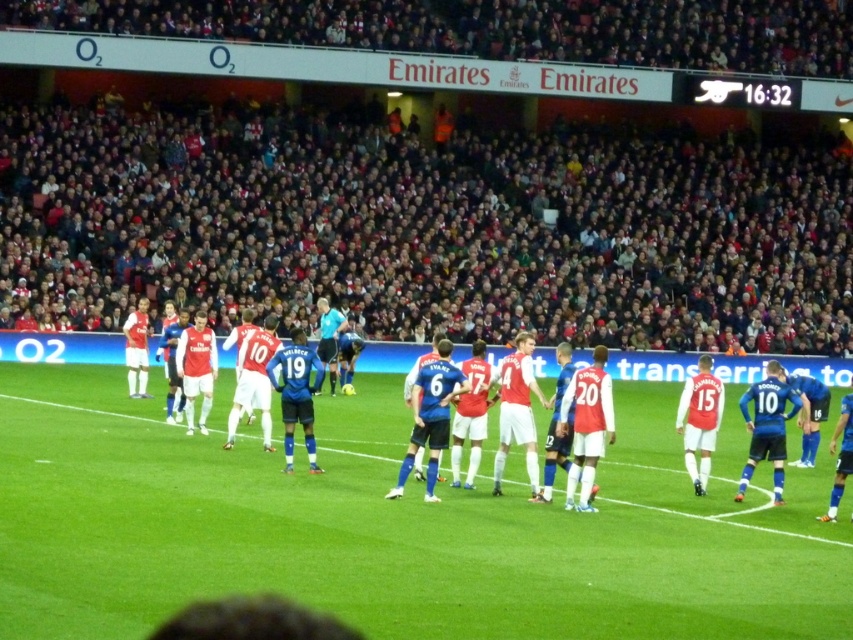
Can you confirm if green grass football field at center is smaller than white jersey at center?

Correct, green grass football field at center occupies less space than white jersey at center.

Is point (86, 550) closer to camera compared to point (339, 317)?

Yes, point (86, 550) is closer to viewer.

In order to click on green grass football field at center in this screenshot , I will do `click(393, 525)`.